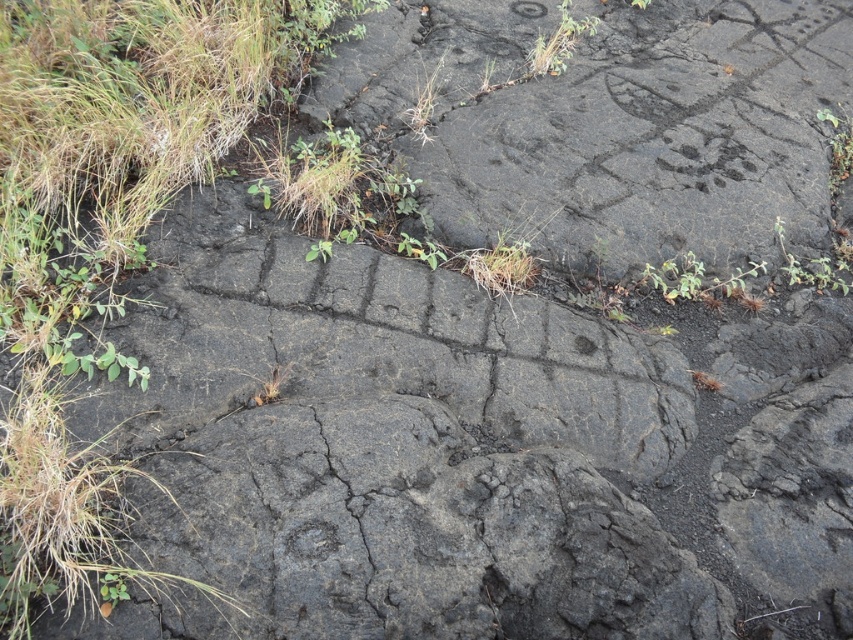
Which is behind, point (844, 179) or point (416, 131)?

Point (844, 179)

Does green leafy plant at upper right appear on the left side of green grass at center?

Incorrect, green leafy plant at upper right is not on the left side of green grass at center.

Is point (817, 118) positioned before point (421, 132)?

No, (817, 118) is behind (421, 132).

Where is `green leafy plant at upper right`? The width and height of the screenshot is (853, 640). green leafy plant at upper right is located at coordinates (838, 148).

Looking at this image, is green leafy plant at upper center bigger than green leafy plant at upper right?

Indeed, green leafy plant at upper center has a larger size compared to green leafy plant at upper right.

You are a GUI agent. You are given a task and a screenshot of the screen. Output one action in this format:
    pyautogui.click(x=<x>, y=<y>)
    Task: Click on the green leafy plant at upper center
    The height and width of the screenshot is (640, 853).
    Given the screenshot: What is the action you would take?
    pyautogui.click(x=558, y=42)

Who is more forward, (567, 54) or (849, 156)?

Point (849, 156) is more forward.

The height and width of the screenshot is (640, 853). What are the coordinates of `green leafy plant at upper center` in the screenshot? It's located at (558, 42).

Is green leafy plant at upper center shorter than green grass at center?

In fact, green leafy plant at upper center may be taller than green grass at center.

Does green leafy plant at upper center come behind green grass at center?

Yes, green leafy plant at upper center is further from the viewer.

This screenshot has height=640, width=853. I want to click on green leafy plant at upper center, so click(x=558, y=42).